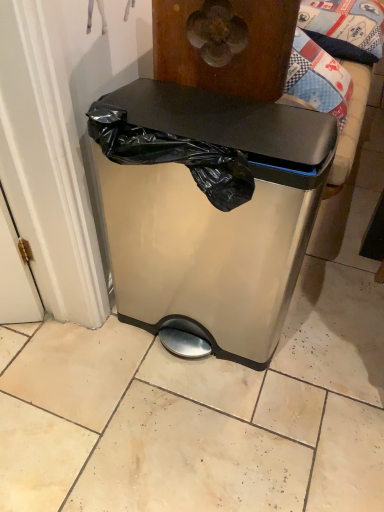
Locate an element on the screen. The height and width of the screenshot is (512, 384). satin silver trash can at center is located at coordinates (208, 214).

Describe the element at coordinates (208, 214) in the screenshot. I see `satin silver trash can at center` at that location.

Find the location of a particular element. Image resolution: width=384 pixels, height=512 pixels. satin silver trash can at center is located at coordinates (208, 214).